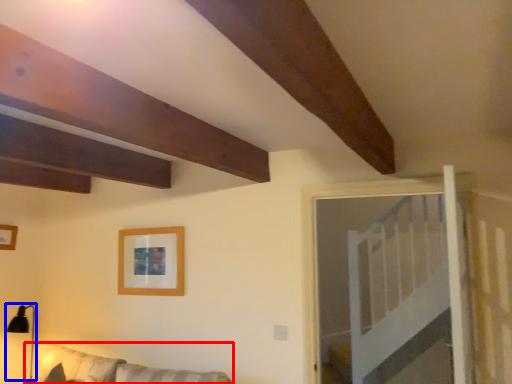
Question: Which point is further to the camera, couch (highlighted by a red box) or lamp (highlighted by a blue box)?

Choices:
 (A) couch
 (B) lamp

Answer: (B)